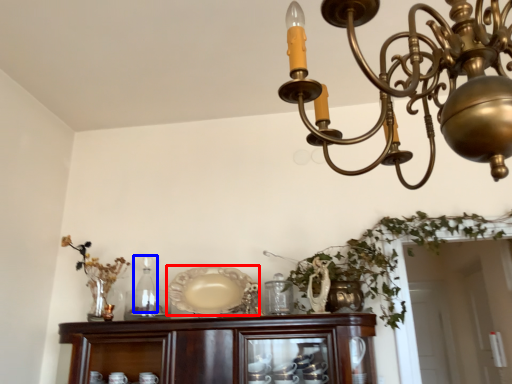
Question: Which object appears closest to the camera in this image, platter (highlighted by a red box) or bottle (highlighted by a blue box)?

Choices:
 (A) platter
 (B) bottle

Answer: (A)